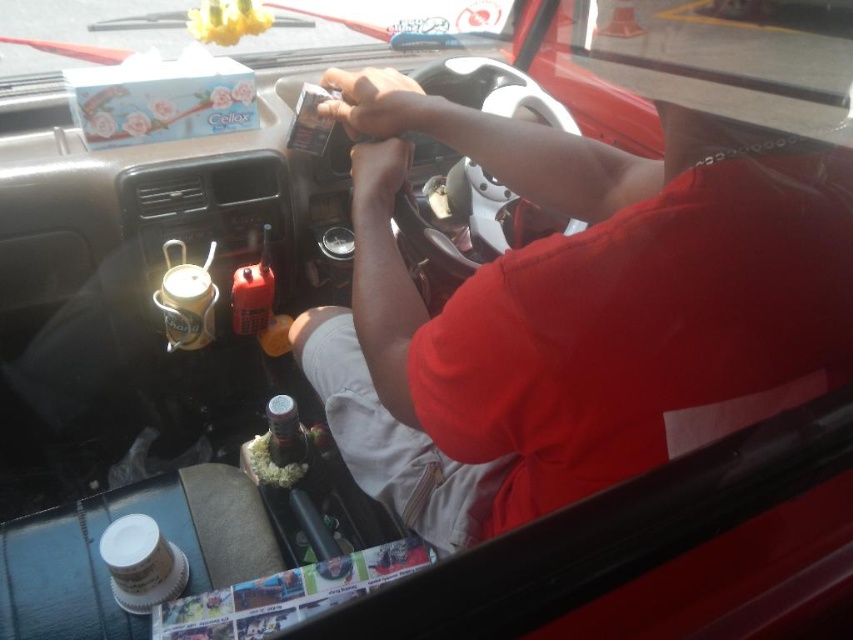
Question: In this image, where is matte skin hand at center located relative to clear plastic bottle at center?

Choices:
 (A) above
 (B) below

Answer: (A)

Question: Which point is closer to the camera taking this photo?

Choices:
 (A) [x=271, y=436]
 (B) [x=386, y=92]
 (C) [x=250, y=464]
 (D) [x=396, y=156]

Answer: (D)

Question: Which point is farther to the camera?

Choices:
 (A) (390, 116)
 (B) (270, 432)
 (C) (355, 157)
 (D) (257, 442)

Answer: (D)

Question: Observing the image, what is the correct spatial positioning of matte black phone at center in reference to white crumbly food at center?

Choices:
 (A) below
 (B) above

Answer: (B)

Question: Is matte black phone at center to the left of white crumbly food at center from the viewer's perspective?

Choices:
 (A) yes
 (B) no

Answer: (B)

Question: Which object is farther from the camera taking this photo?

Choices:
 (A) white crumbly food at center
 (B) matte skin hand at center
 (C) clear plastic bottle at center
 (D) matte black phone at center

Answer: (A)